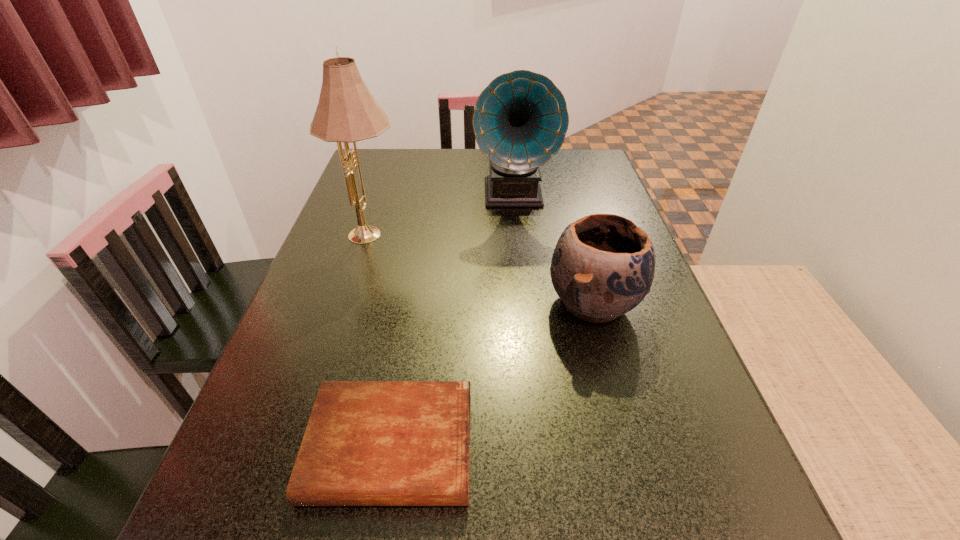
I want to click on lampshade situated at the left edge, so click(x=346, y=112).

At what (x,y) coordinates should I click in order to perform the action: click on Bible that is at the left edge. Please return your answer as a coordinate pair (x, y). Image resolution: width=960 pixels, height=540 pixels. Looking at the image, I should click on (367, 443).

You are a GUI agent. You are given a task and a screenshot of the screen. Output one action in this format:
    pyautogui.click(x=<x>, y=<y>)
    Task: Click on the object positioned at the right edge
    
    Given the screenshot: What is the action you would take?
    pyautogui.click(x=603, y=265)

This screenshot has width=960, height=540. Identify the location of vacant region at the far edge of the desktop. (455, 148).

Where is `blank space at the left edge of the desktop`? The height and width of the screenshot is (540, 960). blank space at the left edge of the desktop is located at coordinates (281, 496).

Locate an element on the screen. Image resolution: width=960 pixels, height=540 pixels. free spot at the right edge of the desktop is located at coordinates (635, 343).

In the image, there is a desktop. Where is `vacant space at the far left corner`? vacant space at the far left corner is located at coordinates (400, 170).

Image resolution: width=960 pixels, height=540 pixels. Identify the location of vacant area that lies between the Bible and the third shortest object. (452, 321).

Identify the location of unoccupied position between the pottery and the tallest object. (483, 268).

At what (x,y) coordinates should I click in order to perform the action: click on unoccupied area between the pottery and the second tallest object. Please return your answer as a coordinate pair (x, y). This screenshot has height=540, width=960. Looking at the image, I should click on (554, 249).